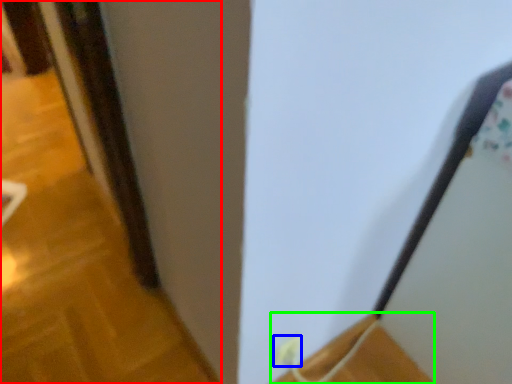
Question: Which object is positioned closest to door (highlighted by a red box)? Select from electric outlet (highlighted by a blue box) and wood (highlighted by a green box).

Choices:
 (A) electric outlet
 (B) wood

Answer: (B)